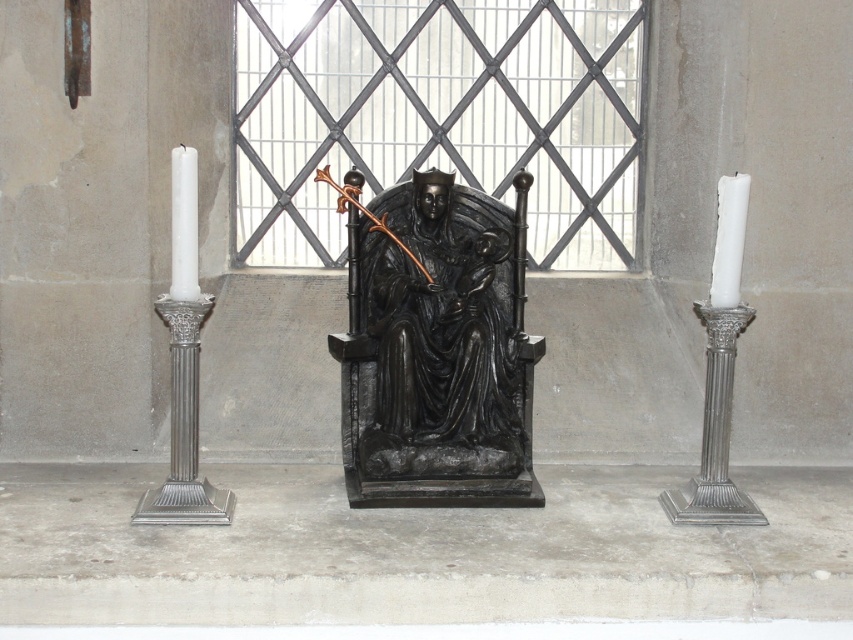
Question: Can you confirm if metallic grid window at center is thinner than silver polished column at left?

Choices:
 (A) yes
 (B) no

Answer: (B)

Question: Is black polished wood throne at center wider than white matte candle at left?

Choices:
 (A) yes
 (B) no

Answer: (A)

Question: Which of the following is the closest to the observer?

Choices:
 (A) silver polished column at left
 (B) white matte candle at left
 (C) white matte candle at right

Answer: (B)

Question: Can you confirm if black polished wood throne at center is thinner than white matte candle at right?

Choices:
 (A) yes
 (B) no

Answer: (B)

Question: Which point appears farthest from the camera in this image?

Choices:
 (A) (381, 136)
 (B) (177, 156)
 (C) (723, 211)

Answer: (A)

Question: Which point is closer to the camera?

Choices:
 (A) silver metallic candlestick at right
 (B) white matte candle at right

Answer: (B)